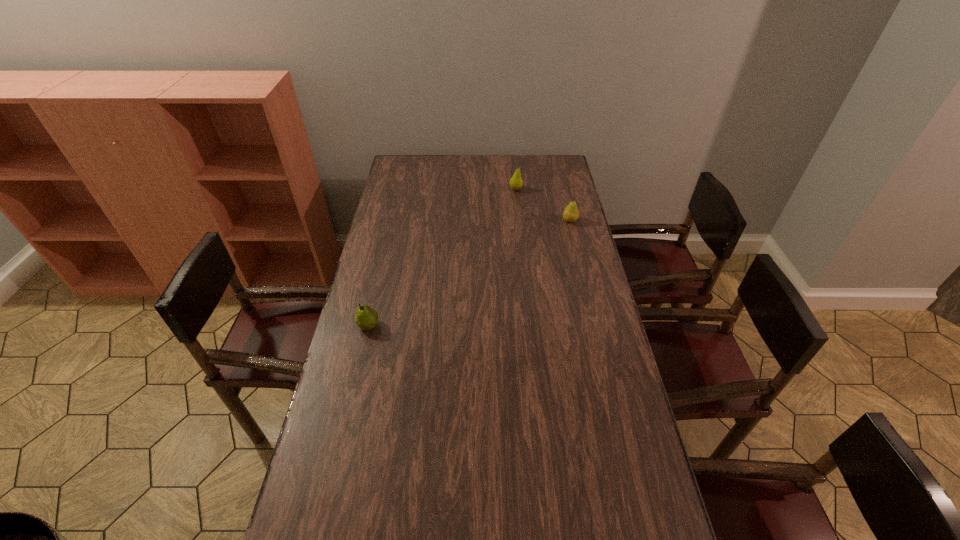
At what (x,y) coordinates should I click in order to perform the action: click on free space between the rightmost pear and the leftmost pear. Please return your answer as a coordinate pair (x, y). The image size is (960, 540). Looking at the image, I should click on pyautogui.click(x=469, y=273).

Identify the location of free space between the second object from left to right and the leftmost pear. The height and width of the screenshot is (540, 960). (443, 258).

In order to click on vacant area that lies between the second pear from right to left and the second nearest pear in this screenshot , I will do (x=542, y=205).

Find the location of `the closest object to the leftmost object`. the closest object to the leftmost object is located at coordinates (571, 213).

Identify the location of the second closest object to the leftmost pear. (516, 182).

At what (x,y) coordinates should I click in order to perform the action: click on pear that is the closest to the rightmost pear. Please return your answer as a coordinate pair (x, y). This screenshot has height=540, width=960. Looking at the image, I should click on (516, 182).

Identify which pear is the nearest to the rightmost pear. Please provide its 2D coordinates. Your answer should be formatted as a tuple, i.e. [(x, y)], where the tuple contains the x and y coordinates of a point satisfying the conditions above.

[(516, 182)]

At what (x,y) coordinates should I click in order to perform the action: click on free spot that satisfies the following two spatial constraints: 1. on the front side of the rightmost pear; 2. on the left side of the second pear from right to left. Please return your answer as a coordinate pair (x, y). Image resolution: width=960 pixels, height=540 pixels. Looking at the image, I should click on (519, 221).